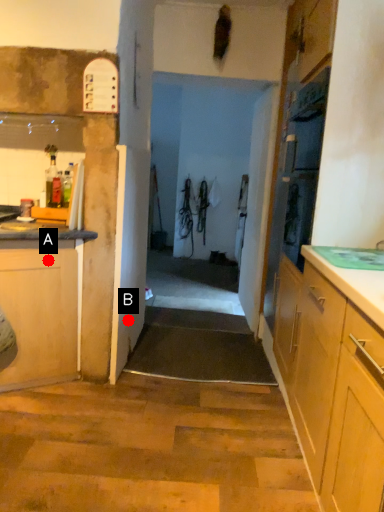
Question: Two points are circled on the image, labeled by A and B beside each circle. Which of the following is the closest to the observer?

Choices:
 (A) A is closer
 (B) B is closer

Answer: (A)